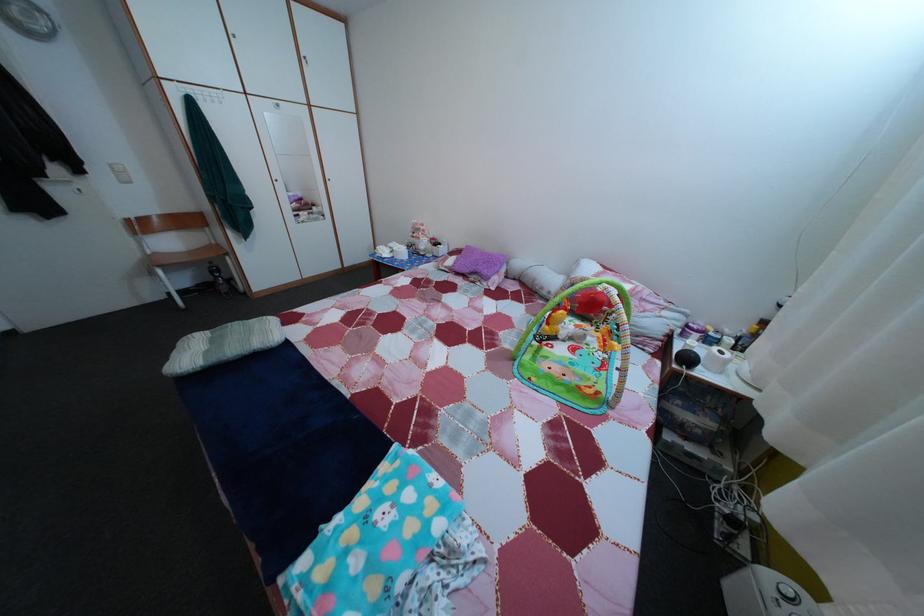
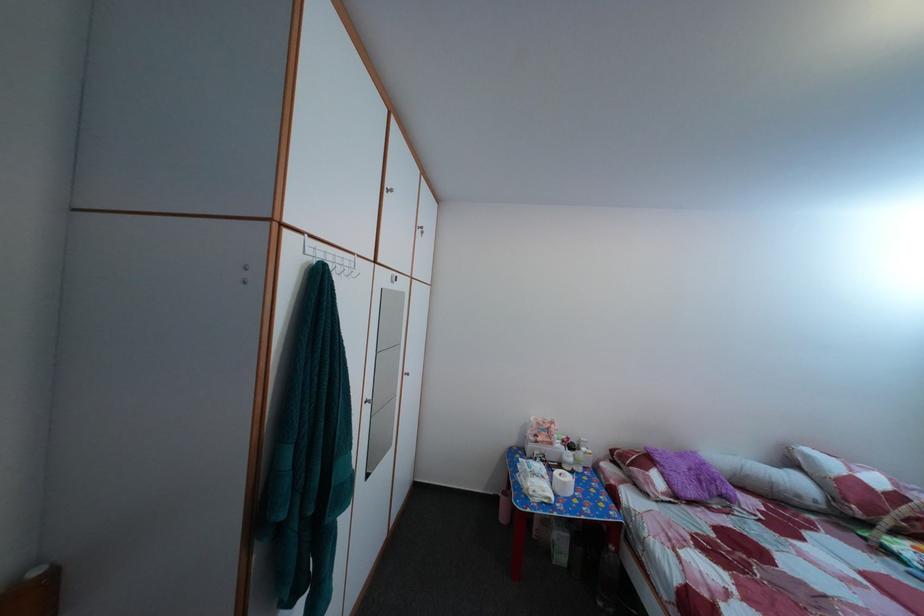
Find the pixel in the second image that matches [492,261] in the first image.

(689, 464)